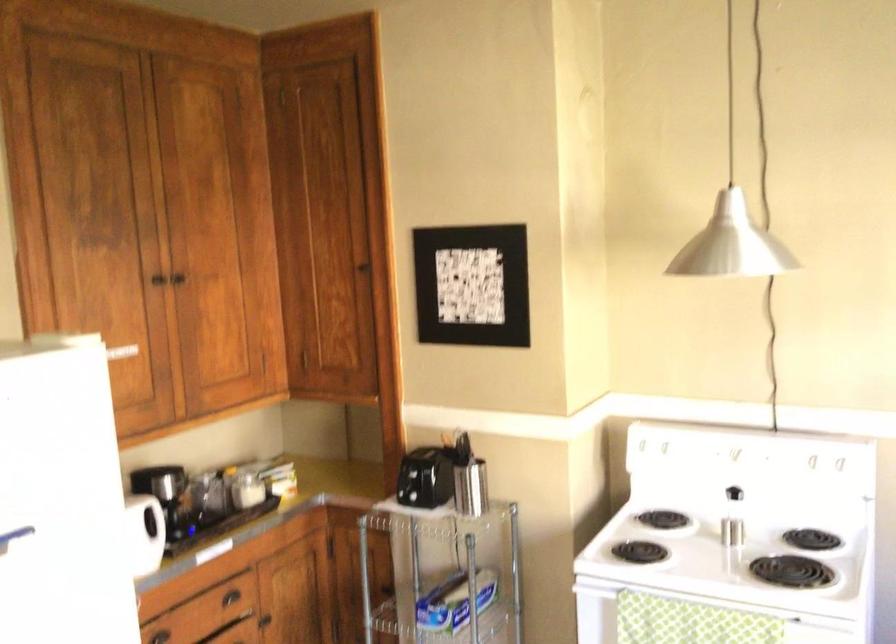
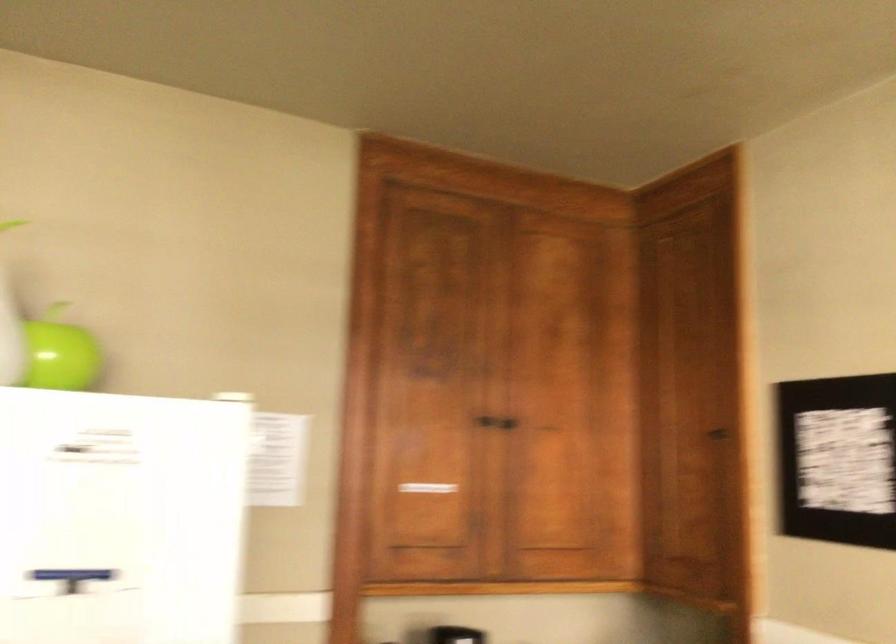
Find the pixel in the second image that matches [185,270] in the first image.

(511, 419)